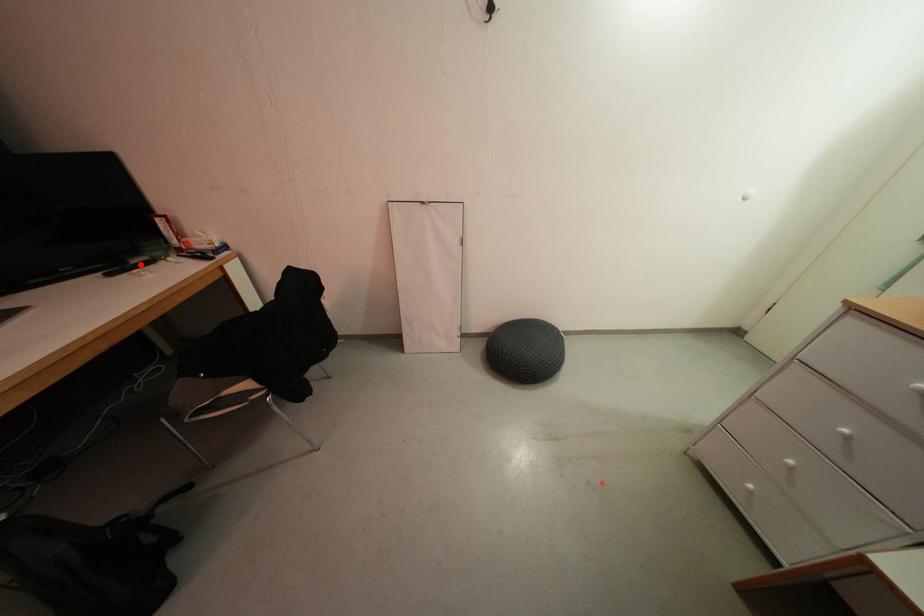
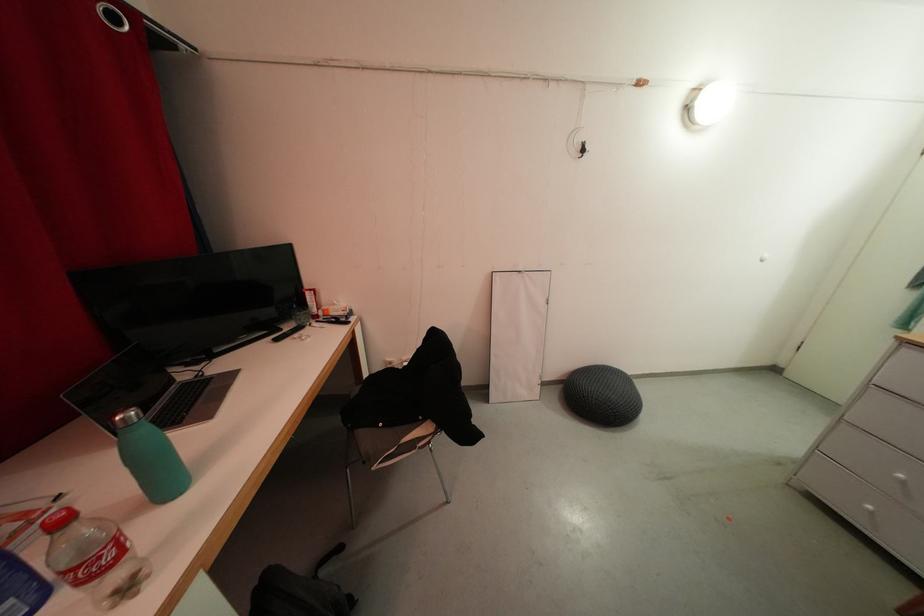
The point at the highlighted location is marked in the first image. Where is the corresponding point in the second image?

(293, 331)